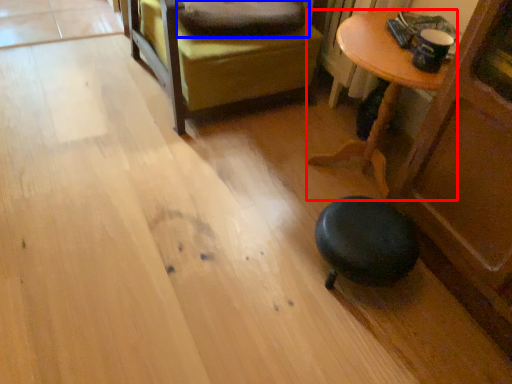
Question: Which of the following is the closest to the observer, table (highlighted by a red box) or pillow (highlighted by a blue box)?

Choices:
 (A) table
 (B) pillow

Answer: (A)